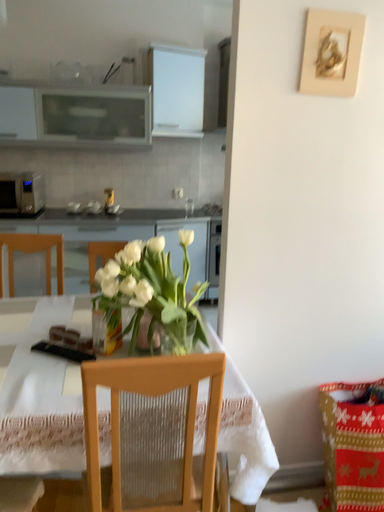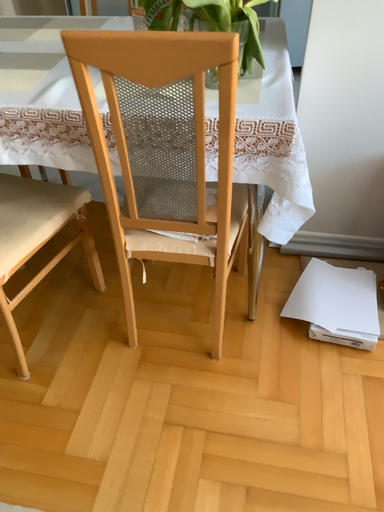
Question: Which way did the camera rotate in the video?

Choices:
 (A) rotated left
 (B) rotated right

Answer: (A)